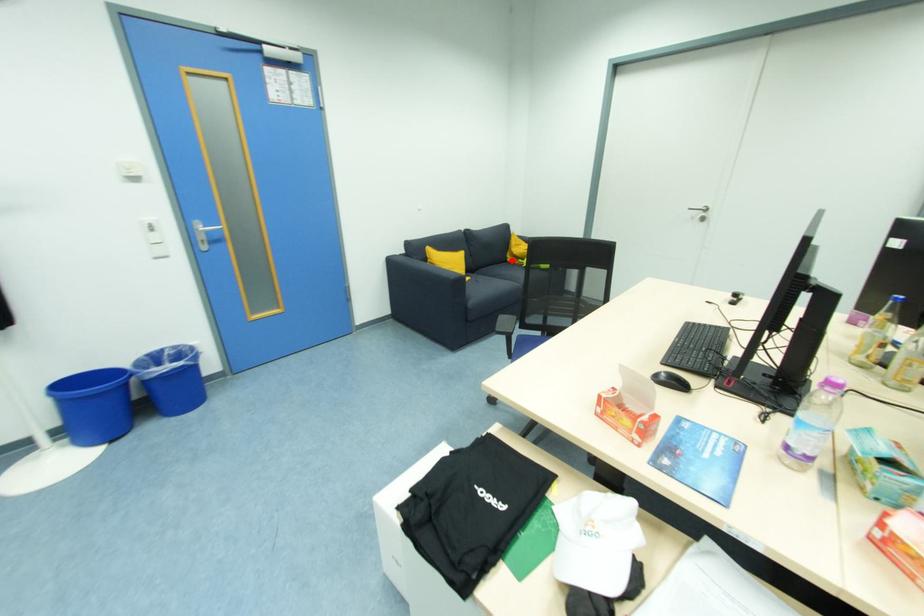
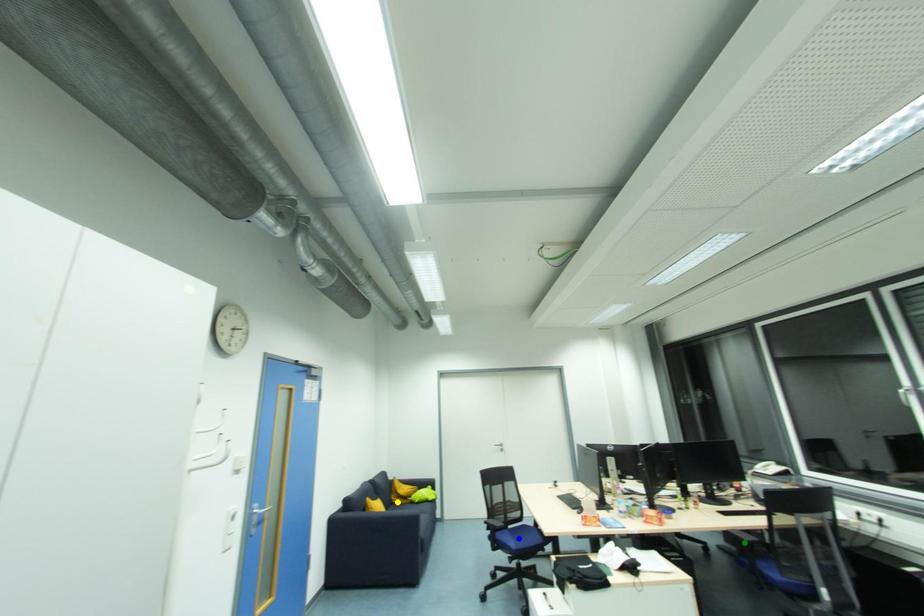
Question: I am providing you with two images of the same scene from different viewpoints. A red point is marked on the first image. You are given multiple points on the second image. Which spot in image 2 lines up with the point in image 1?

Choices:
 (A) yellow point
 (B) blue point
 (C) green point

Answer: (A)